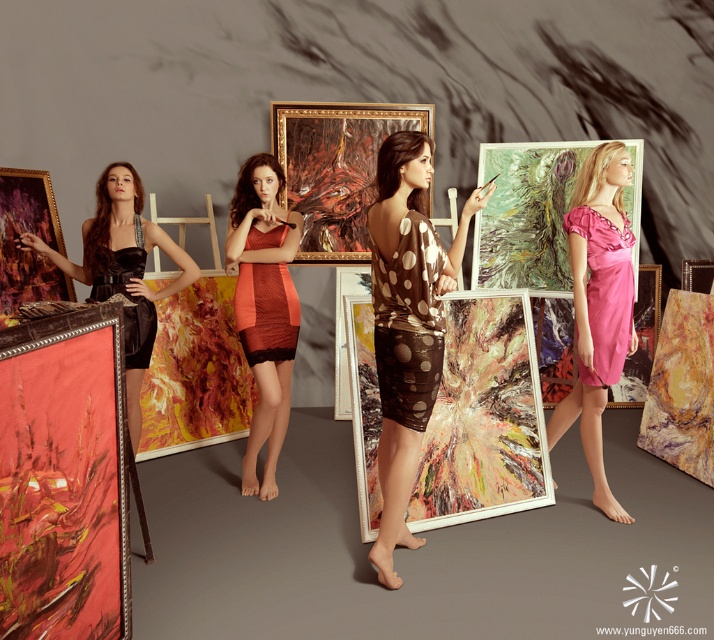
Question: Which is nearer to the orange lace dress at center?

Choices:
 (A) brown dotted fabric dress at center
 (B) oil paint canvas at center
 (C) pink satin dress at center
 (D) brown shiny dress at center

Answer: (D)

Question: In this image, where is shiny gold frame at left located relative to velvet black dress at left?

Choices:
 (A) left
 (B) right

Answer: (A)

Question: Which point appears farthest from the camera in this image?

Choices:
 (A) (408, 396)
 (B) (246, 218)
 (C) (111, 256)
 (D) (346, 260)

Answer: (D)

Question: Is velvet dress at left positioned in front of shiny gold frame at left?

Choices:
 (A) yes
 (B) no

Answer: (B)

Question: Which of the following is the farthest from the observer?

Choices:
 (A) pink satin dress at center
 (B) oil paint canvas at center
 (C) velvet dress at left

Answer: (B)

Question: Considering the relative positions of brown shiny dress at center and velvet dress at left in the image provided, where is brown shiny dress at center located with respect to velvet dress at left?

Choices:
 (A) left
 (B) right

Answer: (B)